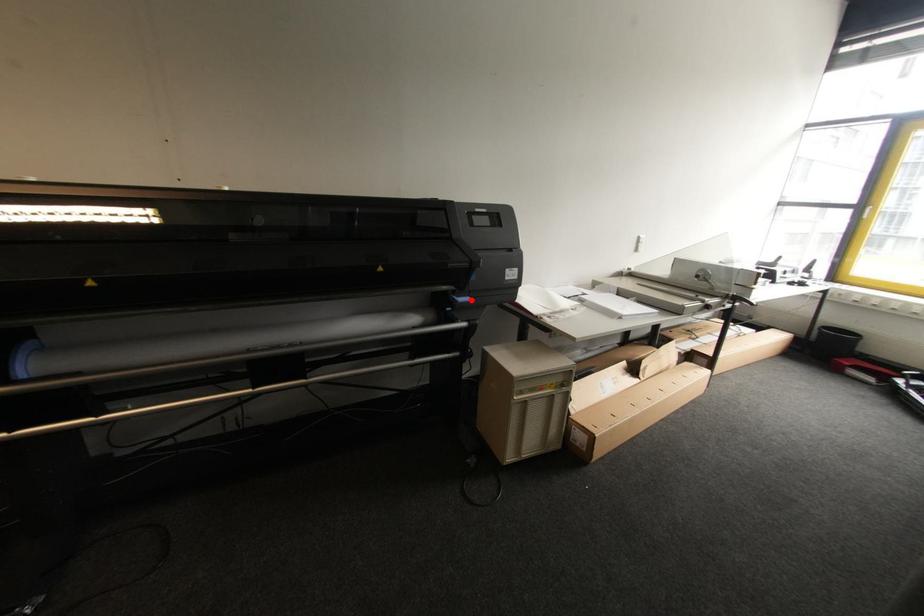
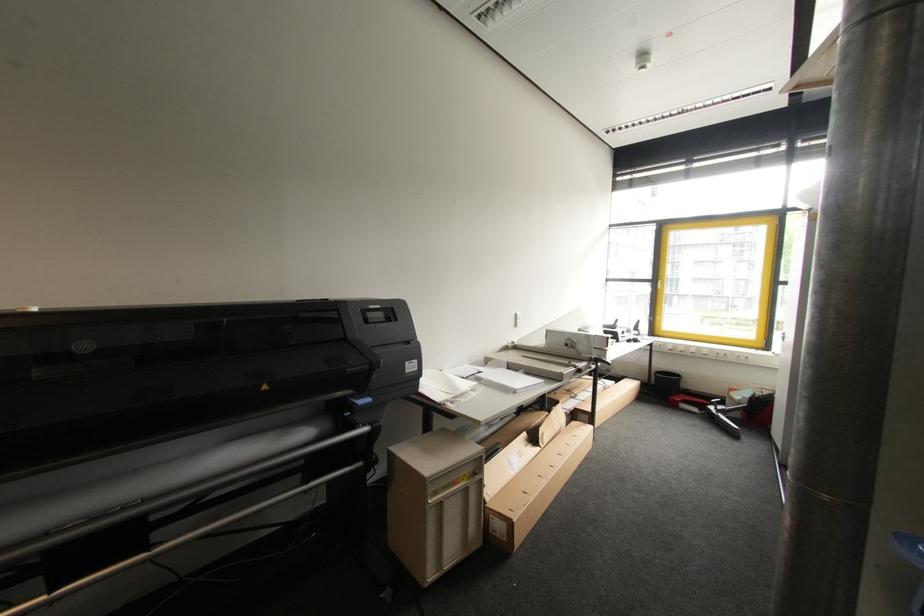
Question: A red point is marked in image1. In image2, is the corresponding 3D point closer to the camera or farther? Reply with the corresponding letter.

Choices:
 (A) The corresponding 3D point is closer.
 (B) The corresponding 3D point is farther.

Answer: (B)